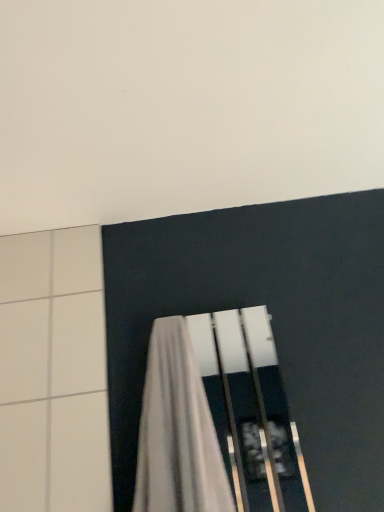
Question: Is white fabric curtain at lower center oriented towards white matte wall at upper center?

Choices:
 (A) no
 (B) yes

Answer: (A)

Question: Is white fabric curtain at lower center outside of white matte wall at upper center?

Choices:
 (A) yes
 (B) no

Answer: (A)

Question: From a real-world perspective, is white fabric curtain at lower center beneath white matte wall at upper center?

Choices:
 (A) no
 (B) yes

Answer: (B)

Question: Does white fabric curtain at lower center lie in front of white matte wall at upper center?

Choices:
 (A) no
 (B) yes

Answer: (A)

Question: Considering the relative sizes of white fabric curtain at lower center and white matte wall at upper center in the image provided, is white fabric curtain at lower center taller than white matte wall at upper center?

Choices:
 (A) no
 (B) yes

Answer: (B)

Question: Is white fabric curtain at lower center to the right of white matte wall at upper center from the viewer's perspective?

Choices:
 (A) no
 (B) yes

Answer: (A)

Question: Considering the relative sizes of white matte wall at upper center and white fabric curtain at lower center in the image provided, is white matte wall at upper center taller than white fabric curtain at lower center?

Choices:
 (A) yes
 (B) no

Answer: (B)

Question: From the image's perspective, is white matte wall at upper center above white fabric curtain at lower center?

Choices:
 (A) no
 (B) yes

Answer: (B)

Question: Does white matte wall at upper center appear on the left side of white fabric curtain at lower center?

Choices:
 (A) no
 (B) yes

Answer: (A)

Question: From a real-world perspective, is white matte wall at upper center physically below white fabric curtain at lower center?

Choices:
 (A) no
 (B) yes

Answer: (A)

Question: Considering the relative positions of white matte wall at upper center and white fabric curtain at lower center in the image provided, is white matte wall at upper center to the right of white fabric curtain at lower center from the viewer's perspective?

Choices:
 (A) yes
 (B) no

Answer: (A)

Question: Is white matte wall at upper center further to camera compared to white fabric curtain at lower center?

Choices:
 (A) no
 (B) yes

Answer: (A)

Question: From a real-world perspective, is white matte wall at upper center physically located above or below white fabric curtain at lower center?

Choices:
 (A) below
 (B) above

Answer: (B)